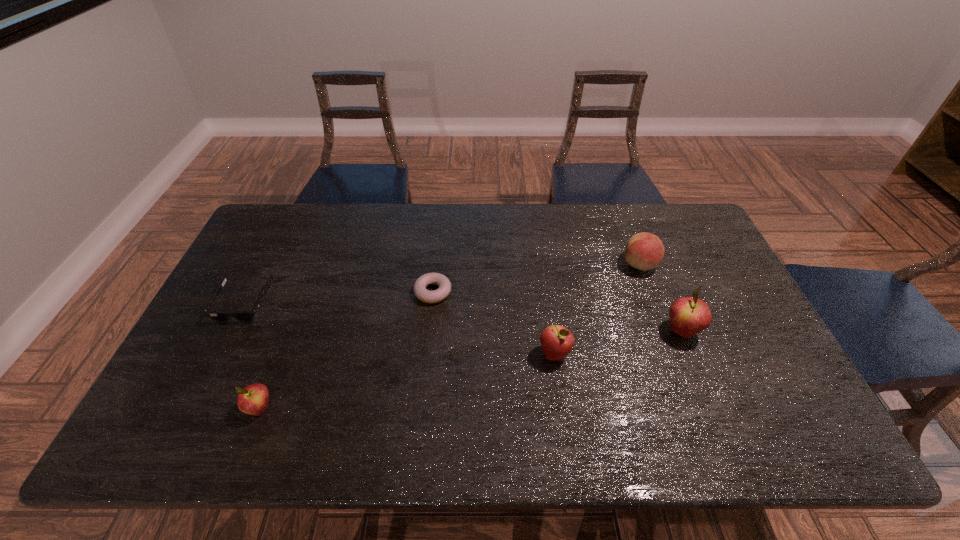
Image resolution: width=960 pixels, height=540 pixels. In order to click on vacant position located on the right of the nearest object in this screenshot , I will do `click(434, 409)`.

This screenshot has width=960, height=540. I want to click on free point located 0.180m on the left of the third object from right to left, so click(x=469, y=354).

At what (x,y) coordinates should I click in order to perform the action: click on vacant space located 0.090m on the left of the tallest apple. Please return your answer as a coordinate pair (x, y). The width and height of the screenshot is (960, 540). Looking at the image, I should click on (632, 331).

I want to click on free location located on the temples of the leftmost object, so click(x=223, y=345).

Identify the location of vacant space located 0.120m on the front of the peach. (655, 307).

Identify the location of vacant space located on the right of the fourth object from right to left. Image resolution: width=960 pixels, height=540 pixels. (498, 292).

The width and height of the screenshot is (960, 540). In order to click on object that is at the near edge in this screenshot , I will do `click(253, 399)`.

This screenshot has width=960, height=540. I want to click on object that is at the left edge, so 243,316.

The width and height of the screenshot is (960, 540). What are the coordinates of `object at the right edge` in the screenshot? It's located at (688, 315).

This screenshot has height=540, width=960. Find the location of `free spot at the far edge of the desktop`. free spot at the far edge of the desktop is located at coordinates (612, 224).